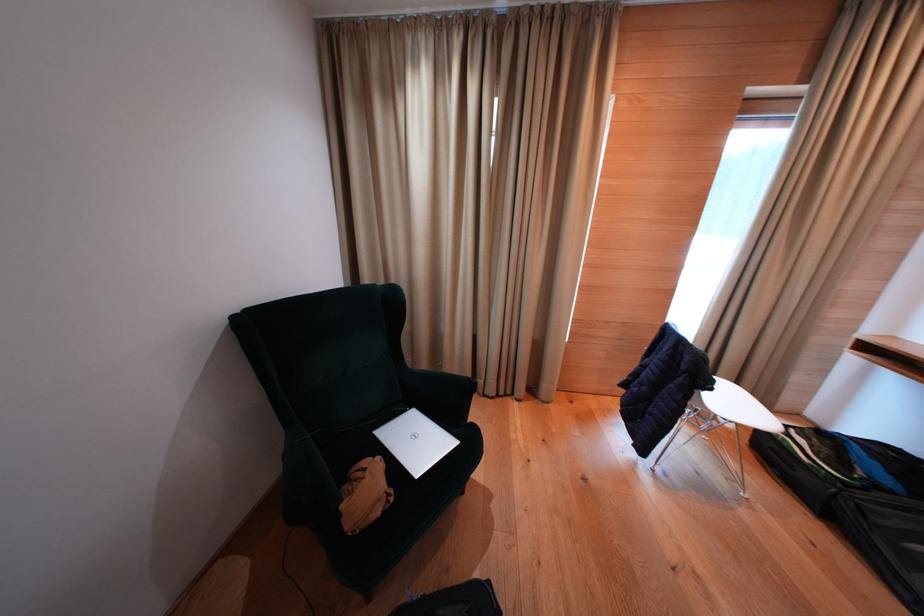
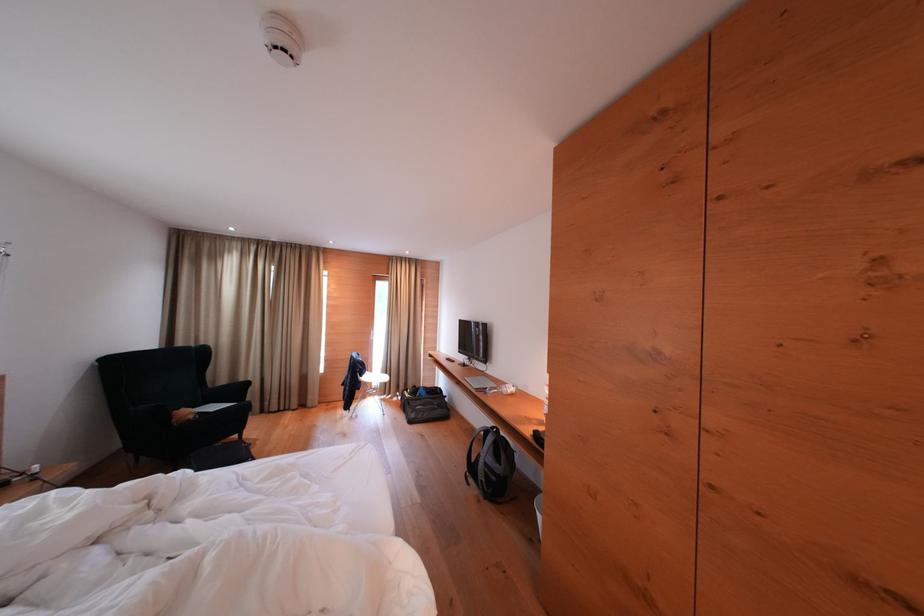
Where in the second image is the point corresponding to (x=385, y=516) from the first image?

(198, 421)